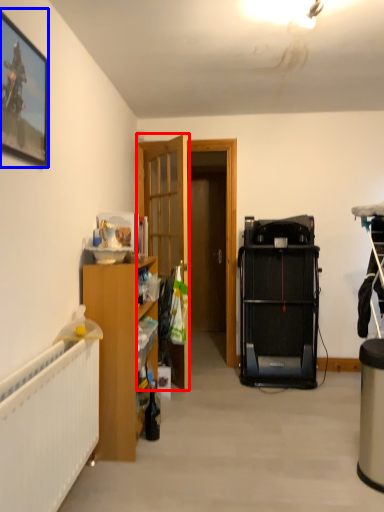
Question: Which object is closer to the camera taking this photo, door (highlighted by a red box) or picture frame (highlighted by a blue box)?

Choices:
 (A) door
 (B) picture frame

Answer: (B)